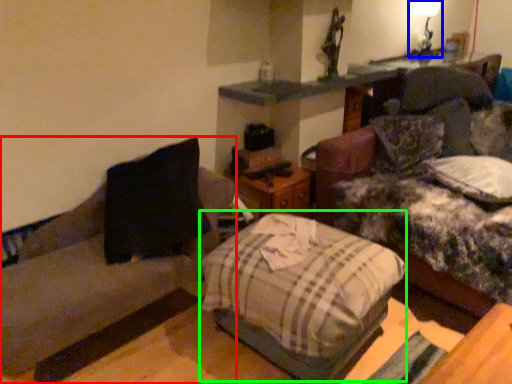
Question: Estimate the real-world distances between objects in this image. Which object is farther from studio couch (highlighted by a red box), light fixture (highlighted by a blue box) or bed (highlighted by a green box)?

Choices:
 (A) light fixture
 (B) bed

Answer: (A)